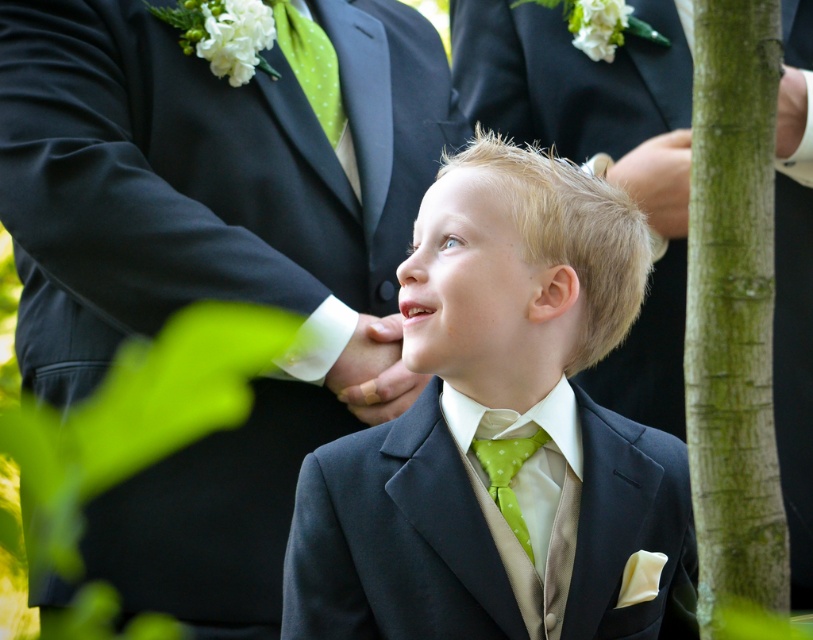
You are a photographer at a formal event. You notice the matte black suit at center and the green dotted fabric tie at center. Which object is positioned closer to you?

The matte black suit at center is closer to the viewer than the green dotted fabric tie at center.

Based on the scene description, can you determine which object is positioned lower between the green dotted fabric tie at center and the matte green nose at center?

The green dotted fabric tie at center is located below the matte green nose at center, so the green dotted fabric tie at center is positioned lower.

Based on the scene description, where is the matte black suit at center located in relation to the green dotted fabric tie at center?

The matte black suit at center is to the right of the green dotted fabric tie at center.